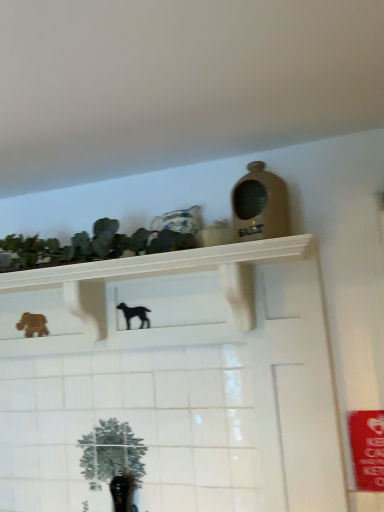
Question: In terms of size, does wooden horse at left, the second animal in the front-to-back sequence, appear bigger or smaller than white glossy shelf at upper center?

Choices:
 (A) big
 (B) small

Answer: (B)

Question: Which is correct: wooden horse at left, which ranks as the 1th animal in left-to-right order, is inside white glossy shelf at upper center, or outside of it?

Choices:
 (A) outside
 (B) inside

Answer: (A)

Question: Estimate the real-world distances between objects in this image. Which object is closer to the white glossy shelf at upper center?

Choices:
 (A) green matte cactus at upper left
 (B) black matte dog at center, which is counted as the first animal, starting from the front
 (C) wooden horse at left, which ranks as the 1th animal in left-to-right order

Answer: (A)

Question: Based on their relative distances, which object is nearer to the green matte cactus at upper left?

Choices:
 (A) wooden horse at left, the second animal in the front-to-back sequence
 (B) black matte dog at center, the 2th animal positioned from the left
 (C) white glossy shelf at upper center

Answer: (C)